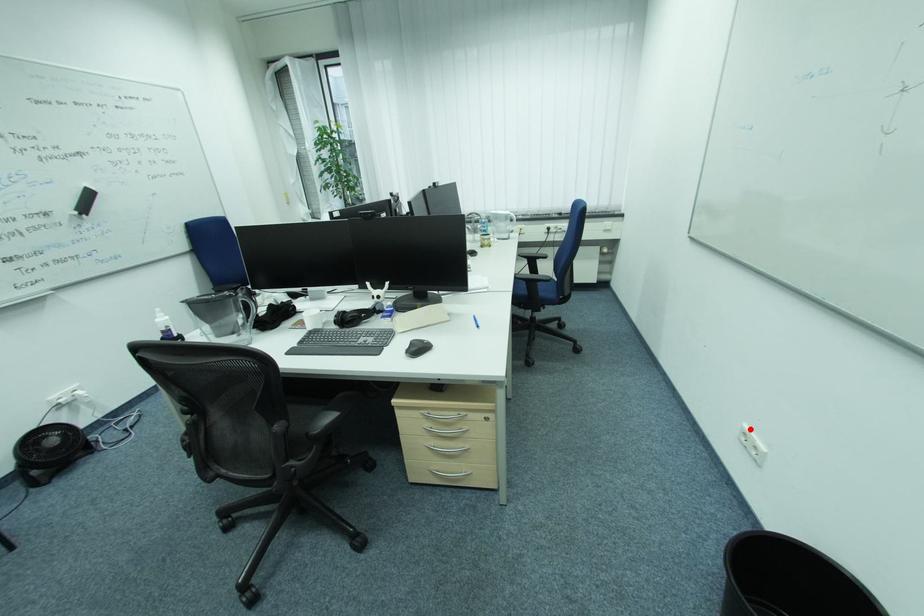
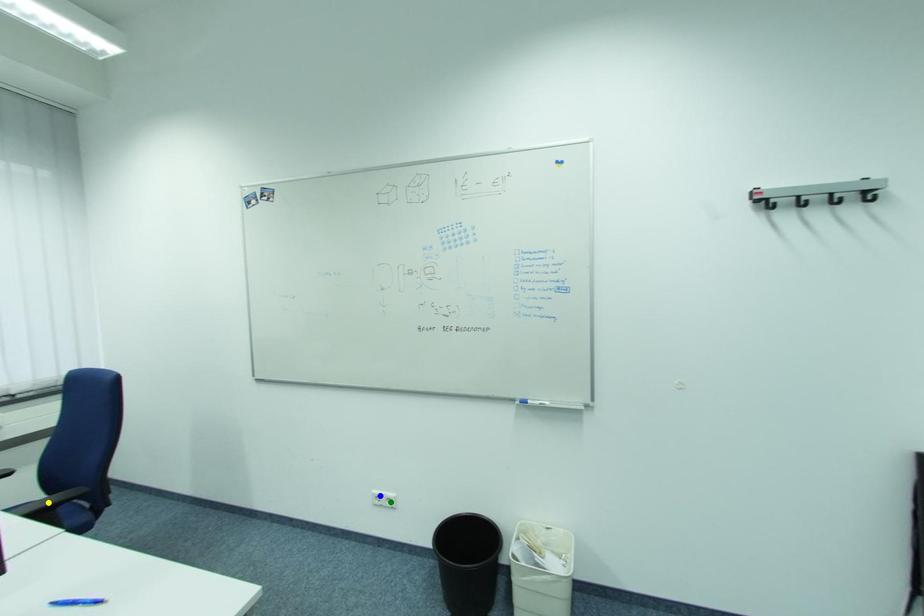
Question: I am providing you with two images of the same scene from different viewpoints. A red point is marked on the first image. You are given multiple points on the second image. Can you choose the point in image 2 that corresponds to the point in image 1?

Choices:
 (A) blue point
 (B) green point
 (C) yellow point

Answer: (A)